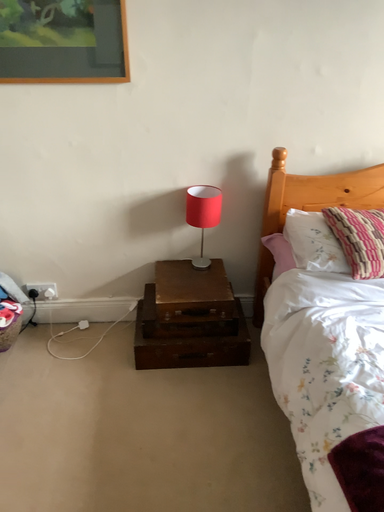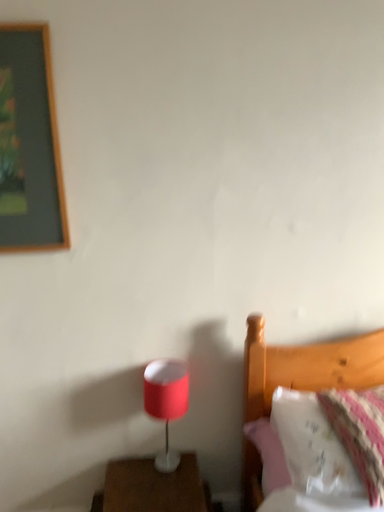
Question: Which way did the camera rotate in the video?

Choices:
 (A) rotated downward
 (B) rotated upward

Answer: (B)